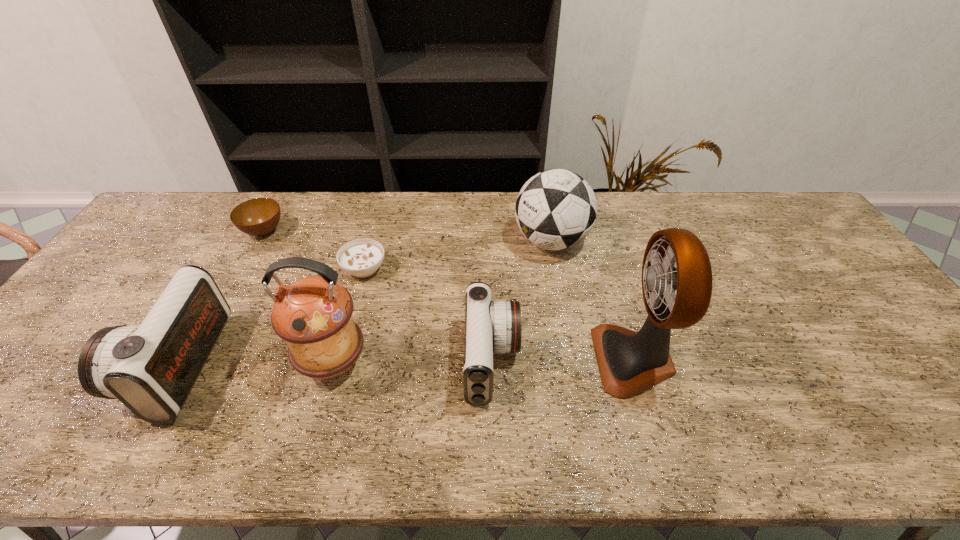
Where is `blank area located on the surface of the left camcorder`? This screenshot has width=960, height=540. blank area located on the surface of the left camcorder is located at coordinates (112, 364).

Identify the location of blank space located on the surface of the left camcorder. The width and height of the screenshot is (960, 540). (121, 364).

At what (x,y) coordinates should I click in order to perform the action: click on vacant area situated 0.120m on the surface of the fifth tallest object. Please return your answer as a coordinate pair (x, y). Looking at the image, I should click on (567, 361).

Locate an element on the screen. The image size is (960, 540). vacant area situated on the surface of the soccer ball where the brand logo is visible is located at coordinates (424, 241).

At what (x,y) coordinates should I click in order to perform the action: click on free space located 0.120m on the surface of the soccer ball where the brand logo is visible. Please return your answer as a coordinate pair (x, y). The width and height of the screenshot is (960, 540). Looking at the image, I should click on (475, 241).

The width and height of the screenshot is (960, 540). I want to click on vacant point located on the surface of the soccer ball where the brand logo is visible, so click(450, 241).

Locate an element on the screen. This screenshot has width=960, height=540. free space located on the front of the bowl is located at coordinates (218, 315).

Locate an element on the screen. vacant point located 0.380m on the front-facing side of the fan is located at coordinates (442, 360).

Identify the location of vacant region located on the front-facing side of the fan. This screenshot has width=960, height=540. (474, 360).

Locate an element on the screen. The width and height of the screenshot is (960, 540). vacant area situated 0.340m on the front-facing side of the fan is located at coordinates (458, 360).